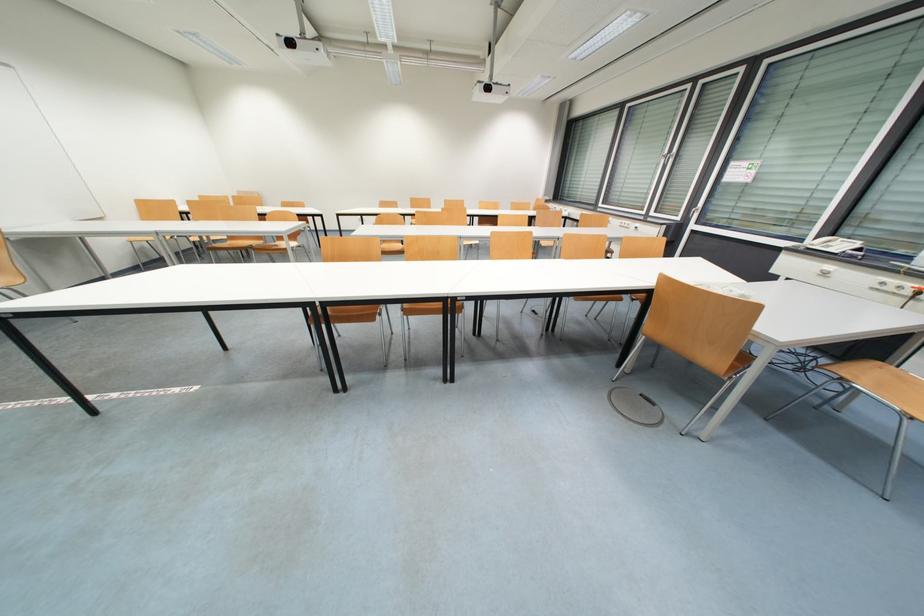
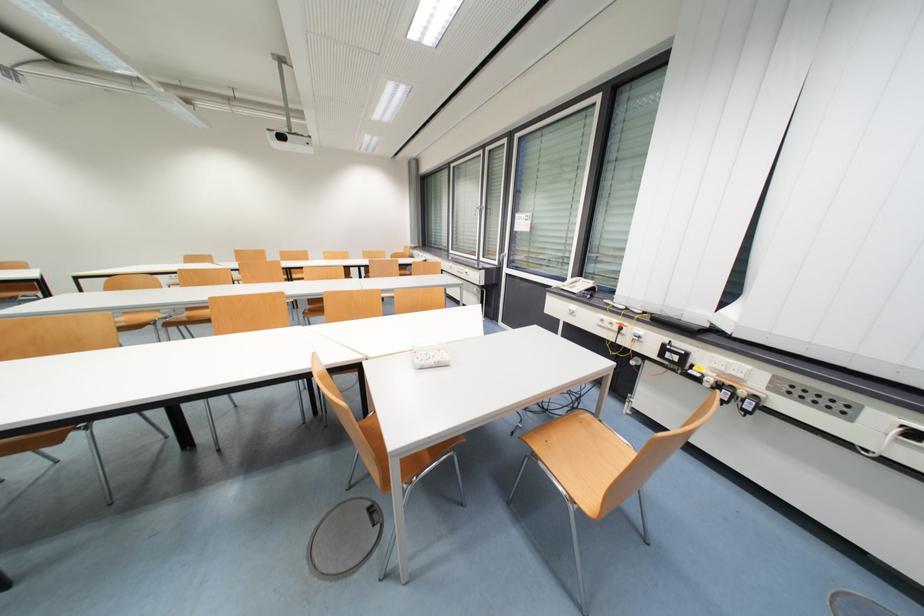
Locate, in the second image, the point that corresponds to (x=846, y=246) in the first image.

(587, 286)